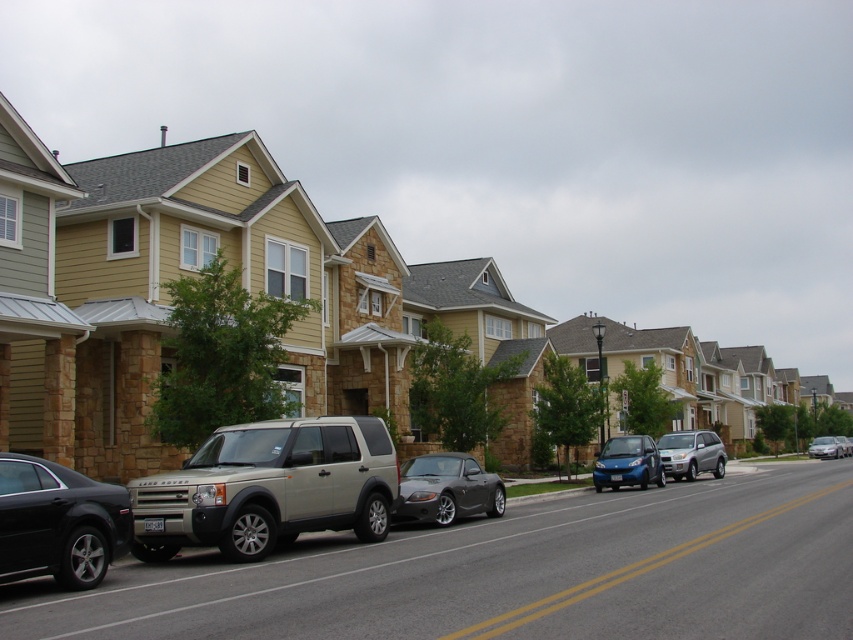
Does satin gold suv at center lie in front of shiny blue car at center?

That is True.

Between satin gold suv at center and shiny blue car at center, which one appears on the right side from the viewer's perspective?

From the viewer's perspective, shiny blue car at center appears more on the right side.

Does point (282, 520) lie behind point (659, 480)?

No, (282, 520) is in front of (659, 480).

Locate an element on the screen. The height and width of the screenshot is (640, 853). satin gold suv at center is located at coordinates (270, 486).

Between shiny black sedan at left and shiny blue car at center, which one appears on the right side from the viewer's perspective?

From the viewer's perspective, shiny blue car at center appears more on the right side.

Who is more distant from viewer, (41,513) or (618,483)?

Point (618,483)

Find the location of a particular element. shiny black sedan at left is located at coordinates (57, 522).

Which is more to the right, shiny black sedan at left or metallic silver sedan at center-right?

metallic silver sedan at center-right is more to the right.

Is shiny black sedan at left positioned behind metallic silver sedan at center-right?

No.

Describe the element at coordinates (57, 522) in the screenshot. The height and width of the screenshot is (640, 853). I see `shiny black sedan at left` at that location.

At what (x,y) coordinates should I click in order to perform the action: click on shiny black sedan at left. Please return your answer as a coordinate pair (x, y). Looking at the image, I should click on (57, 522).